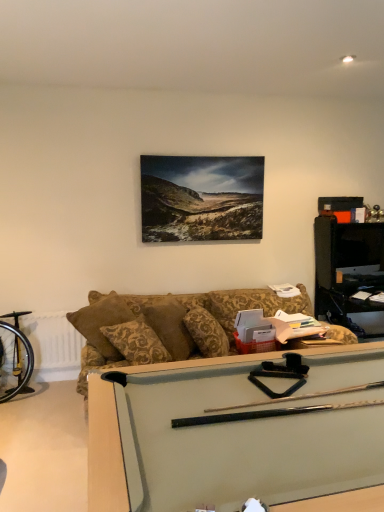
The image size is (384, 512). I want to click on gold metallic bicycle wheel at left, so click(x=14, y=361).

This screenshot has width=384, height=512. Describe the element at coordinates (14, 361) in the screenshot. I see `gold metallic bicycle wheel at left` at that location.

What is the approximate height of gold metallic bicycle wheel at left?

gold metallic bicycle wheel at left is 27.18 inches in height.

The height and width of the screenshot is (512, 384). In order to click on gold metallic bicycle wheel at left in this screenshot , I will do `click(14, 361)`.